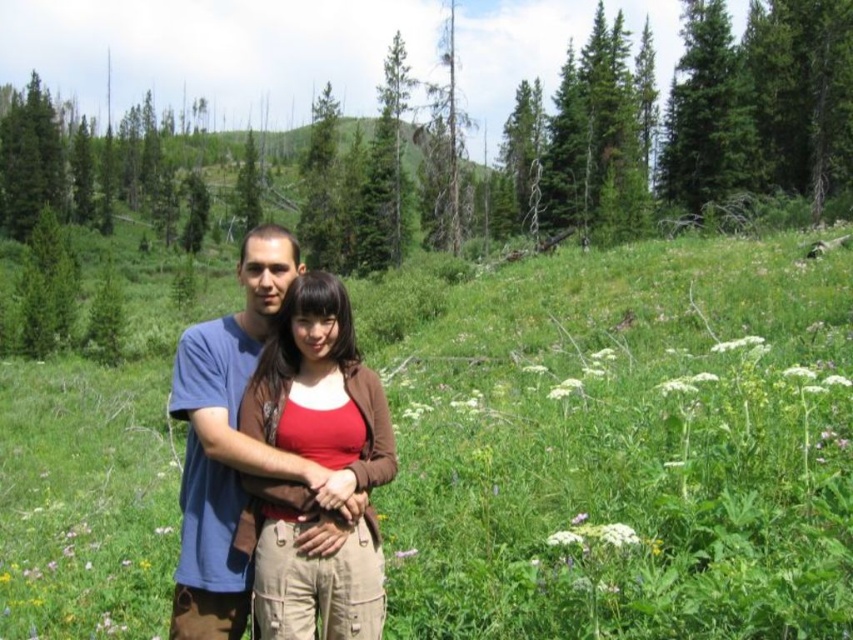
Does point (566, 392) come farther from viewer compared to point (538, 364)?

No, (566, 392) is in front of (538, 364).

This screenshot has height=640, width=853. What do you see at coordinates (558, 392) in the screenshot?
I see `white soft flower at center-right` at bounding box center [558, 392].

I want to click on white soft flower at center-right, so click(x=558, y=392).

Does green grassy field at center have a larger size compared to white fluffy flower at right?

Yes.

Measure the distance between green grassy field at center and camera.

A distance of 10.87 feet exists between green grassy field at center and camera.

At what (x,y) coordinates should I click in order to perform the action: click on green grassy field at center. Please return your answer as a coordinate pair (x, y). Image resolution: width=853 pixels, height=640 pixels. Looking at the image, I should click on (627, 448).

Identify the location of green grassy field at center. This screenshot has width=853, height=640. (627, 448).

Is brown cotton shirt at center closer to the viewer compared to white soft flower at center-right?

Yes, brown cotton shirt at center is in front of white soft flower at center-right.

Which is below, brown cotton shirt at center or white soft flower at center-right?

brown cotton shirt at center

Which is in front, point (379, 609) or point (566, 392)?

Point (379, 609) is in front.

Where is `brown cotton shirt at center`? brown cotton shirt at center is located at coordinates (320, 465).